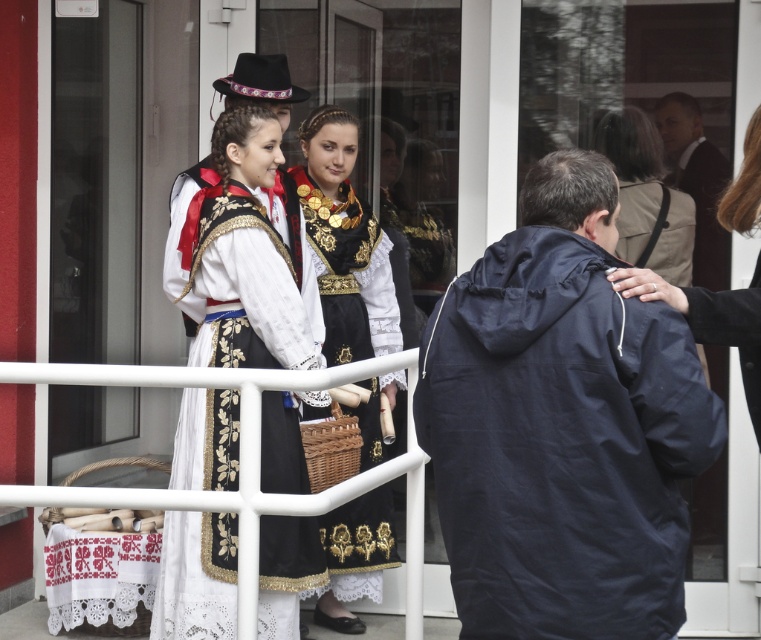
Question: Which of the following is the closest to the observer?

Choices:
 (A) (548, 492)
 (B) (753, 339)

Answer: (A)

Question: Which point is farther from the camera taking this photo?

Choices:
 (A) (677, 237)
 (B) (346, 170)
 (C) (750, 184)

Answer: (A)

Question: Which is farther from the navy blue jacket at right?

Choices:
 (A) brown leather jacket at upper right
 (B) dark blue jacket at right
 (C) white embroidered dress at center
 (D) white lace dress at center

Answer: (B)

Question: Is navy blue jacket at right closer to camera compared to dark blue jacket at right?

Choices:
 (A) no
 (B) yes

Answer: (B)

Question: Is white lace dress at center to the left of dark blue jacket at right from the viewer's perspective?

Choices:
 (A) yes
 (B) no

Answer: (A)

Question: From the image, what is the correct spatial relationship of navy blue jacket at right in relation to white lace dress at center?

Choices:
 (A) above
 (B) below

Answer: (B)